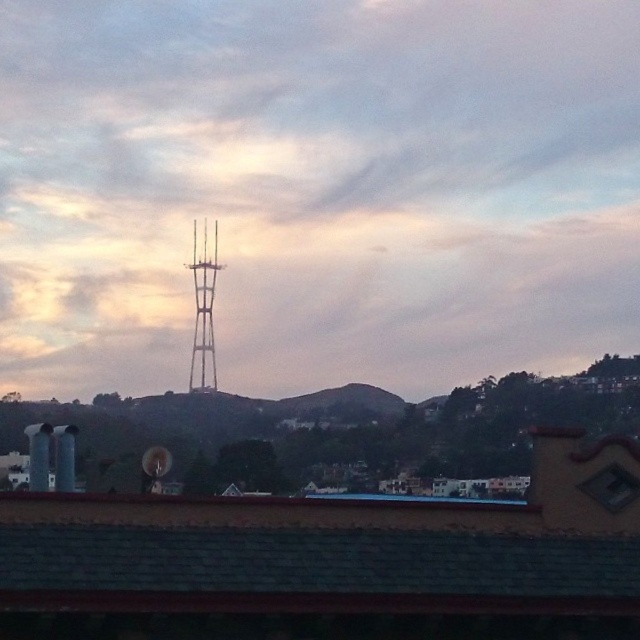
You are an airplane pilot approaching the city and see the white fluffy cloud at upper center and the metallic tower at center. Which object is closer to your airplane?

The white fluffy cloud at upper center is closer to the airplane because it is further to the viewer than the metallic tower at center.

You are standing at the point marked by the coordinates point (339, 404), which is on the green grassy hill at center. You want to walk towards the Sutro Tower in the midground. Which direction should you head?

Since the Sutro Tower is in the midground and the point marked by point (339, 404) is on the green grassy hill at center, you should head towards the direction where the Sutro Tower is located in the midground to reach it.